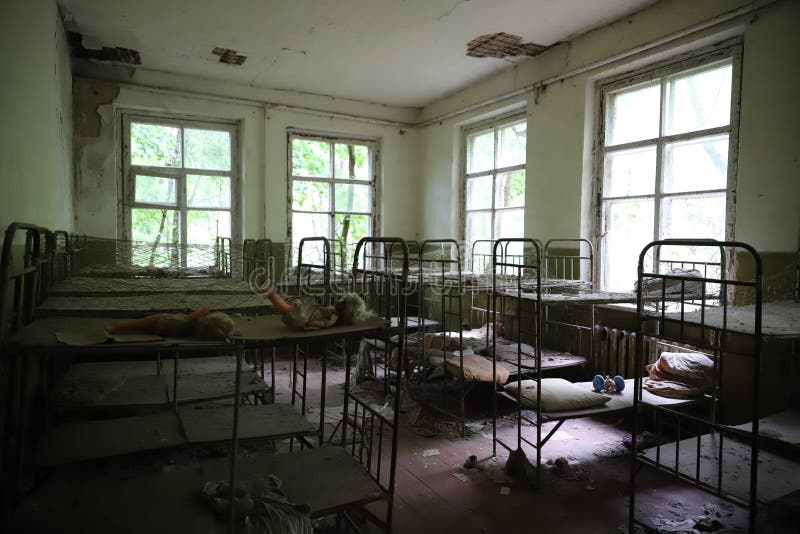
Locate where plaster has fallen from ceiling in the image. Your answer should be formatted as a list of tuples, i.e. [(x1, y1), (x2, y2), ...], where each tuple contains the x and y coordinates of a point satisfying the conditions above.

[(497, 46), (225, 59), (106, 59)]